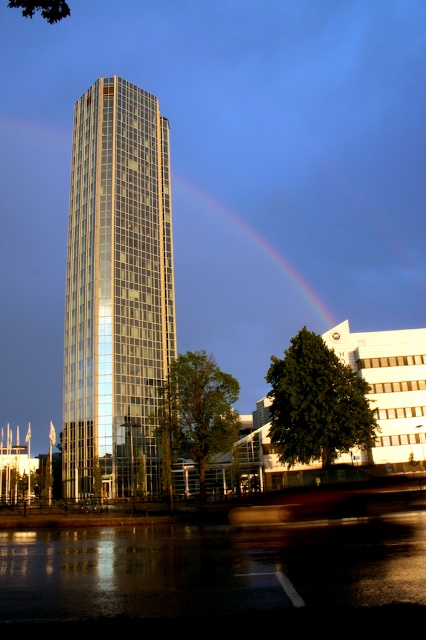
Consider the image. You are a drone operator planning to fly a drone between the glassy metallic tower at center and the rainbow at center. The drone has a maximum flight distance of 100 meters. Can the drone safely travel between them without exceeding its range?

The distance between the glassy metallic tower at center and the rainbow at center is 107.81 meters, which exceeds the drone operator maximum flight distance of 100 meters. The drone cannot safely travel between them without exceeding its range.

You are standing in the urban landscape and want to take a photo of the glassy metallic tower at center. If you move forward by 50 feet, how far will you be from the tower?

The glassy metallic tower at center is initially 246.70 feet away. After moving forward 50 feet, you will be 196.70 feet away from it.

You are an architect analyzing the urban layout. Given the glassy metallic tower at center and the rainbow at center, which one is positioned lower in the image?

The glassy metallic tower at center is located below rainbow at center, so the glassy metallic tower at center is positioned lower.